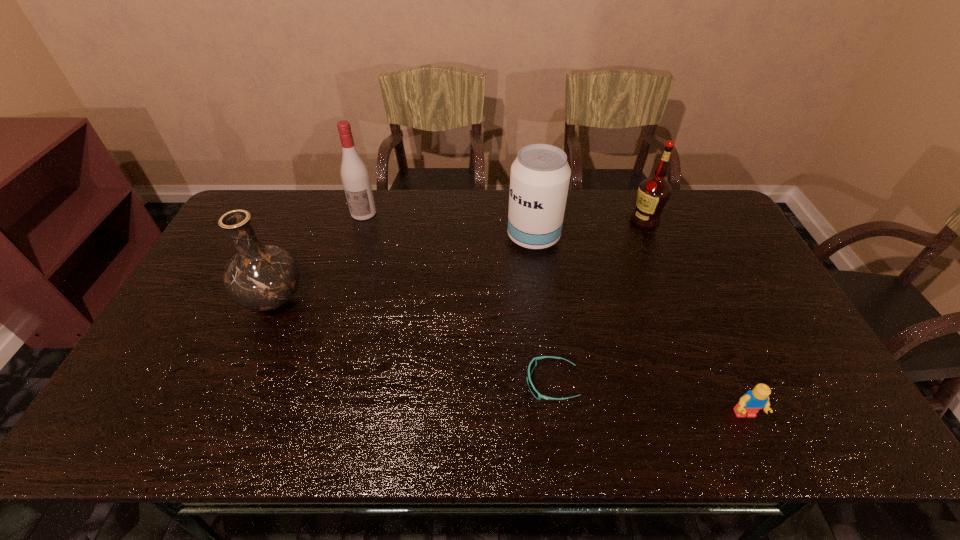
Where is `blank space at the far edge of the desktop`? blank space at the far edge of the desktop is located at coordinates (457, 202).

Where is `vacant space at the near edge of the desktop`? The width and height of the screenshot is (960, 540). vacant space at the near edge of the desktop is located at coordinates (718, 415).

I want to click on free space at the left edge of the desktop, so click(x=222, y=330).

Locate an element on the screen. The width and height of the screenshot is (960, 540). free space at the right edge of the desktop is located at coordinates (727, 250).

Where is `vacant space at the far right corner of the desktop`? The image size is (960, 540). vacant space at the far right corner of the desktop is located at coordinates (702, 206).

The height and width of the screenshot is (540, 960). In order to click on vacant space in between the second alcohol from right to left and the leftmost alcohol in this screenshot , I will do `click(448, 225)`.

What are the coordinates of `free space between the vase and the second alcohol from right to left` in the screenshot? It's located at (403, 268).

The image size is (960, 540). Find the location of `blank region between the fifth farthest object and the nearest object`. blank region between the fifth farthest object and the nearest object is located at coordinates (648, 399).

What are the coordinates of `vacant space in between the sunglasses and the fourth farthest object` in the screenshot? It's located at (413, 341).

The width and height of the screenshot is (960, 540). I want to click on vacant area that lies between the rightmost alcohol and the shortest object, so click(x=598, y=302).